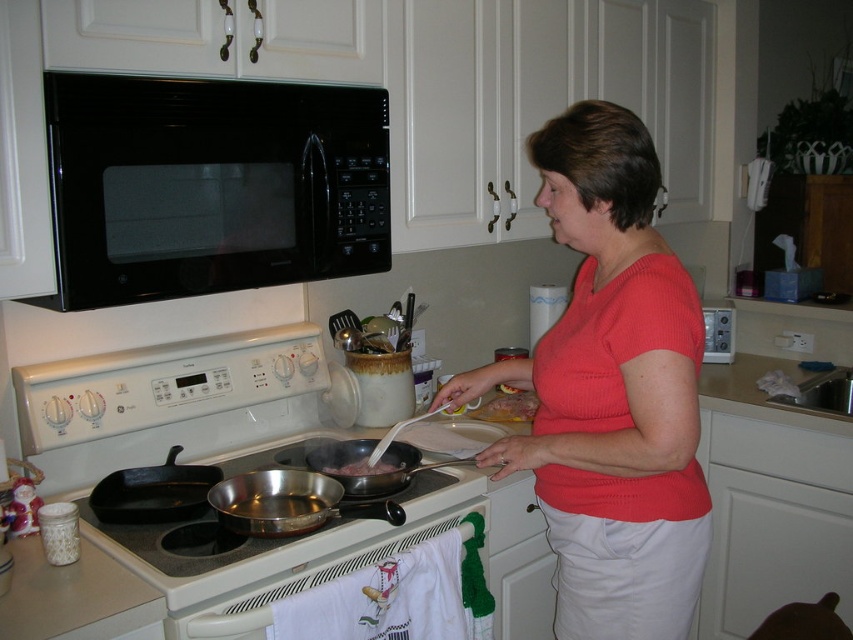
You are a kitchen assistant and need to place a new dish on the counter. The dish is the same size as the black cast iron skillet at stove front. Can you fit it under the black glass microwave at upper center?

The black glass microwave at upper center is larger in size than the black cast iron skillet at stove front, so the dish should fit under it since the microwave is bigger.

In the kitchen scene, there is a point marked at coordinates (210, 186). What object is located at this point?

The point at coordinates (210, 186) marks the location of the black glass microwave at upper center.